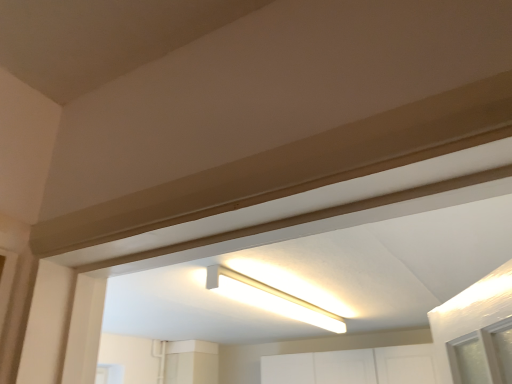
Question: Should I look upward or downward to see white matte fluorescent light at center?

Choices:
 (A) down
 (B) up

Answer: (A)